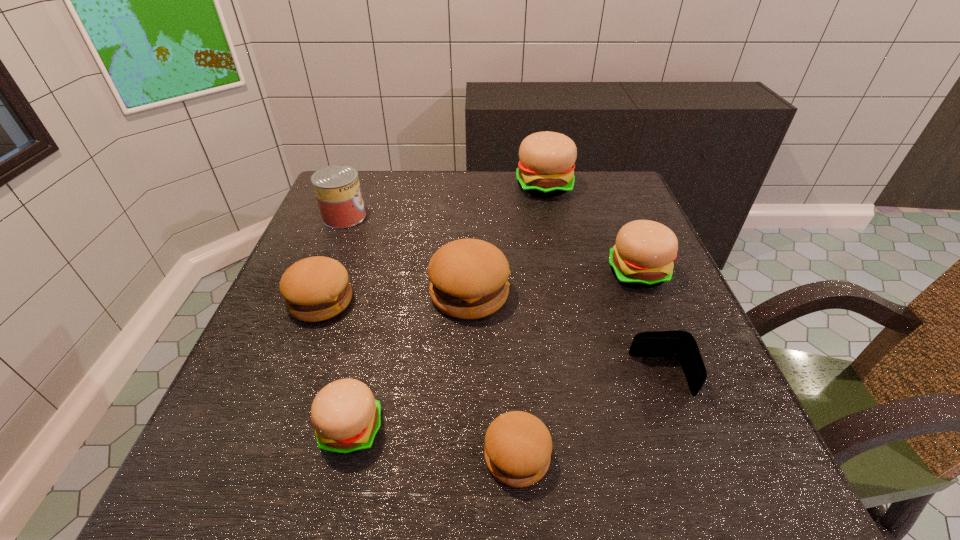
At what (x,y) coordinates should I click in order to perform the action: click on free point between the fifth hamburger from right to left and the wallet. Please return your answer as a coordinate pair (x, y). Looking at the image, I should click on (506, 403).

Identify the location of free space between the nearest beige hamburger and the wallet. The height and width of the screenshot is (540, 960). (506, 403).

Locate an element on the screen. The image size is (960, 540). free space that is in between the can and the farthest object is located at coordinates (444, 201).

I want to click on empty location between the can and the smallest beige hamburger, so click(348, 323).

The height and width of the screenshot is (540, 960). What are the coordinates of `unoccupied area between the second beige hamburger from left to right and the third nearest object` in the screenshot? It's located at (603, 281).

In order to click on object that is the sixth closest one to the can in this screenshot , I will do `click(518, 446)`.

Identify which object is the seventh closest to the second hamburger from left to right. Please provide its 2D coordinates. Your answer should be formatted as a tuple, i.e. [(x, y)], where the tuple contains the x and y coordinates of a point satisfying the conditions above.

[(546, 168)]

In order to click on hamburger that is the fourth closest to the can in this screenshot , I will do `click(346, 416)`.

You are a GUI agent. You are given a task and a screenshot of the screen. Output one action in this format:
    pyautogui.click(x=<x>, y=<y>)
    Task: Click on the third closest hamburger relative to the farthest beige hamburger
    
    Given the screenshot: What is the action you would take?
    pyautogui.click(x=316, y=288)

Where is `beige hamburger that stands as the closest to the rightmost hamburger`? The height and width of the screenshot is (540, 960). beige hamburger that stands as the closest to the rightmost hamburger is located at coordinates click(546, 168).